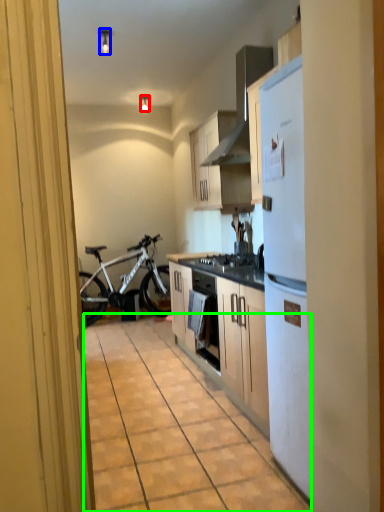
Question: Which object is the closest to the lamp (highlighted by a red box)? Choose among these: lamp (highlighted by a blue box) or alley (highlighted by a green box).

Choices:
 (A) lamp
 (B) alley

Answer: (A)